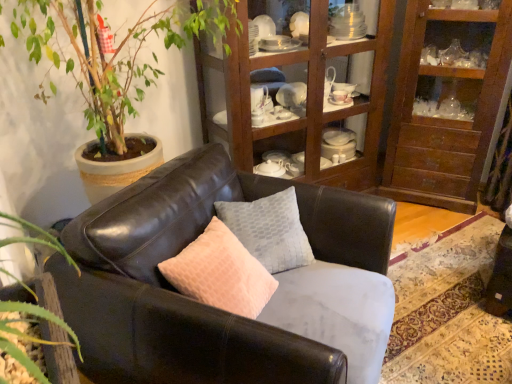
Question: Considering the relative sizes of wooden cabinet at upper right and textured gray pillow at center in the image provided, is wooden cabinet at upper right thinner than textured gray pillow at center?

Choices:
 (A) no
 (B) yes

Answer: (A)

Question: From the image's perspective, is wooden cabinet at upper right on top of textured gray pillow at center?

Choices:
 (A) yes
 (B) no

Answer: (A)

Question: Can you confirm if wooden cabinet at upper right is smaller than textured gray pillow at center?

Choices:
 (A) yes
 (B) no

Answer: (B)

Question: Are wooden cabinet at upper right and textured gray pillow at center beside each other?

Choices:
 (A) yes
 (B) no

Answer: (B)

Question: Is wooden cabinet at upper right positioned behind textured gray pillow at center?

Choices:
 (A) no
 (B) yes

Answer: (B)

Question: Is matte leather couch at center situated inside textured gray pillow at center or outside?

Choices:
 (A) inside
 (B) outside

Answer: (B)

Question: In the image, is matte leather couch at center on the left side or the right side of textured gray pillow at center?

Choices:
 (A) right
 (B) left

Answer: (B)

Question: From a real-world perspective, is matte leather couch at center positioned above or below textured gray pillow at center?

Choices:
 (A) above
 (B) below

Answer: (B)

Question: Considering the positions of matte leather couch at center and textured gray pillow at center in the image, is matte leather couch at center wider or thinner than textured gray pillow at center?

Choices:
 (A) thin
 (B) wide

Answer: (B)

Question: Based on their positions, is wooden cabinet at upper right located to the left or right of matte leather couch at center?

Choices:
 (A) right
 (B) left

Answer: (A)

Question: From the image's perspective, relative to matte leather couch at center, is wooden cabinet at upper right above or below?

Choices:
 (A) below
 (B) above

Answer: (B)

Question: Considering the positions of wooden cabinet at upper right and matte leather couch at center in the image, is wooden cabinet at upper right bigger or smaller than matte leather couch at center?

Choices:
 (A) small
 (B) big

Answer: (A)

Question: Choose the correct answer: Is wooden cabinet at upper right inside matte leather couch at center or outside it?

Choices:
 (A) inside
 (B) outside

Answer: (B)

Question: Is green leafy plant at upper left inside or outside of wooden cabinet at upper center?

Choices:
 (A) outside
 (B) inside

Answer: (A)

Question: Is green leafy plant at upper left taller or shorter than wooden cabinet at upper center?

Choices:
 (A) tall
 (B) short

Answer: (B)